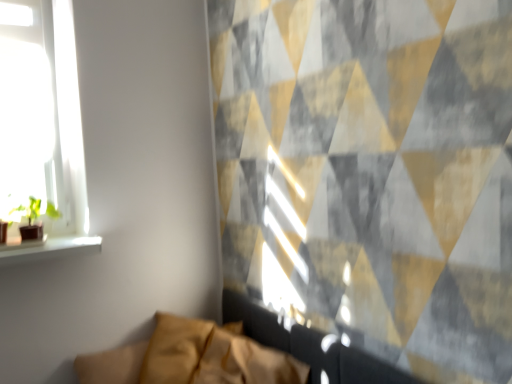
Describe the element at coordinates (30, 220) in the screenshot. This screenshot has width=512, height=384. I see `green matte houseplant at left` at that location.

This screenshot has width=512, height=384. What are the coordinates of `green matte houseplant at left` in the screenshot? It's located at (30, 220).

In order to face green matte houseplant at left, should I rotate leftwards or rightwards?

To align with it, rotate left about 27.406°.

Locate an element on the screen. Image resolution: width=512 pixels, height=384 pixels. leather-like tan couch at lower center is located at coordinates click(252, 353).

Describe the element at coordinates (252, 353) in the screenshot. The height and width of the screenshot is (384, 512). I see `leather-like tan couch at lower center` at that location.

Measure the distance between point (198, 372) and camera.

Point (198, 372) is 5.24 feet away from camera.

The image size is (512, 384). Find the location of `green matte houseplant at left`. green matte houseplant at left is located at coordinates (30, 220).

Can you confirm if leather-like tan couch at lower center is positioned to the right of green matte houseplant at left?

Yes, leather-like tan couch at lower center is to the right of green matte houseplant at left.

From the picture: In the image, is leather-like tan couch at lower center positioned in front of or behind green matte houseplant at left?

Visually, leather-like tan couch at lower center is located in front of green matte houseplant at left.

Is point (333, 372) farther from viewer compared to point (35, 200)?

No.

From the image's perspective, would you say leather-like tan couch at lower center is positioned over green matte houseplant at left?

No, from the image's perspective, leather-like tan couch at lower center is not over green matte houseplant at left.

From a real-world perspective, is leather-like tan couch at lower center on green matte houseplant at left?

Actually, leather-like tan couch at lower center is physically below green matte houseplant at left in the real world.

Between leather-like tan couch at lower center and green matte houseplant at left, which one has smaller width?

green matte houseplant at left.

Between leather-like tan couch at lower center and green matte houseplant at left, which one has more height?

leather-like tan couch at lower center.

Which of these two, leather-like tan couch at lower center or green matte houseplant at left, is bigger?

Bigger between the two is leather-like tan couch at lower center.

Is leather-like tan couch at lower center spatially inside green matte houseplant at left, or outside of it?

leather-like tan couch at lower center exists outside the volume of green matte houseplant at left.

Is there a large distance between leather-like tan couch at lower center and green matte houseplant at left?

leather-like tan couch at lower center is actually quite close to green matte houseplant at left.

Does leather-like tan couch at lower center turn towards green matte houseplant at left?

No, leather-like tan couch at lower center does not turn towards green matte houseplant at left.

Can you tell me how much leather-like tan couch at lower center and green matte houseplant at left differ in facing direction?

The facing directions of leather-like tan couch at lower center and green matte houseplant at left are 87.6 degrees apart.

How much distance is there between leather-like tan couch at lower center and green matte houseplant at left?

31.51 inches.

Find the location of a particular element. The height and width of the screenshot is (384, 512). couch below the green matte houseplant at left (from the image's perspective) is located at coordinates (252, 353).

Between green matte houseplant at left and leather-like tan couch at lower center, which one appears on the right side from the viewer's perspective?

From the viewer's perspective, leather-like tan couch at lower center appears more on the right side.

Is green matte houseplant at left in front of or behind leather-like tan couch at lower center in the image?

In the image, green matte houseplant at left appears behind leather-like tan couch at lower center.

Is point (32, 234) in front of point (311, 352)?

That is False.

From the image's perspective, is green matte houseplant at left above or below leather-like tan couch at lower center?

Based on their image positions, green matte houseplant at left is located above leather-like tan couch at lower center.

From a real-world perspective, is green matte houseplant at left above or below leather-like tan couch at lower center?

In terms of real-world spatial position, green matte houseplant at left is above leather-like tan couch at lower center.

In terms of width, does green matte houseplant at left look wider or thinner when compared to leather-like tan couch at lower center?

green matte houseplant at left is thinner than leather-like tan couch at lower center.

Considering the sizes of objects green matte houseplant at left and leather-like tan couch at lower center in the image provided, who is taller, green matte houseplant at left or leather-like tan couch at lower center?

Standing taller between the two is leather-like tan couch at lower center.

Looking at the image, does green matte houseplant at left seem bigger or smaller compared to leather-like tan couch at lower center?

green matte houseplant at left is smaller than leather-like tan couch at lower center.

Is green matte houseplant at left outside of leather-like tan couch at lower center?

Yes, green matte houseplant at left is not within leather-like tan couch at lower center.

Is green matte houseplant at left next to leather-like tan couch at lower center?

No, green matte houseplant at left is not touching leather-like tan couch at lower center.

Is green matte houseplant at left aimed at leather-like tan couch at lower center?

No, green matte houseplant at left is not aimed at leather-like tan couch at lower center.

Can you tell me how much green matte houseplant at left and leather-like tan couch at lower center differ in facing direction?

There is a 87.6-degree angle between the facing directions of green matte houseplant at left and leather-like tan couch at lower center.

Measure the distance between green matte houseplant at left and leather-like tan couch at lower center.

The distance of green matte houseplant at left from leather-like tan couch at lower center is 80.03 centimeters.

At what (x,y) coordinates should I click in order to perform the action: click on houseplant to the left of leather-like tan couch at lower center. Please return your answer as a coordinate pair (x, y). The image size is (512, 384). Looking at the image, I should click on (30, 220).

At what (x,y) coordinates should I click in order to perform the action: click on houseplant above the leather-like tan couch at lower center (from the image's perspective). Please return your answer as a coordinate pair (x, y). Looking at the image, I should click on (30, 220).

Locate an element on the screen. This screenshot has width=512, height=384. couch below the green matte houseplant at left (from the image's perspective) is located at coordinates (252, 353).